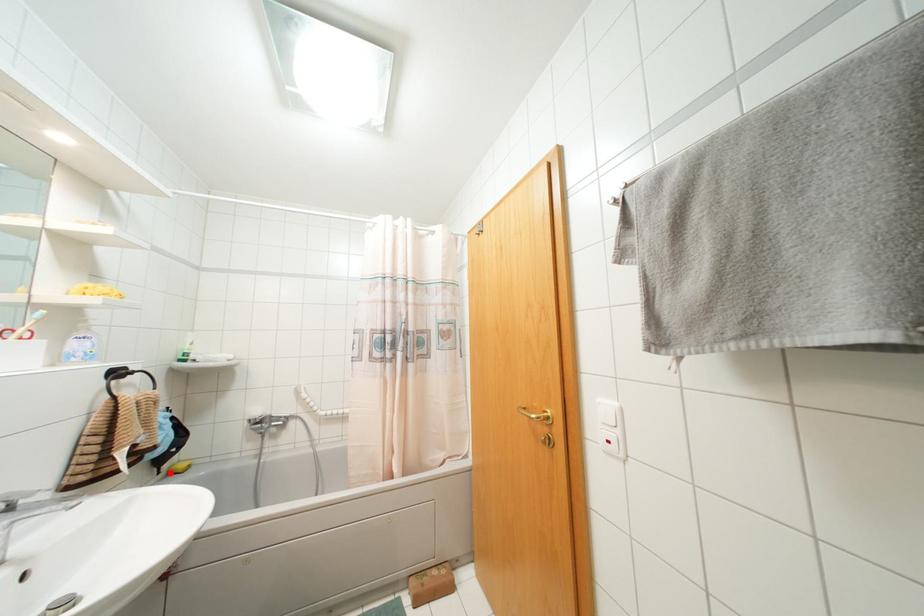
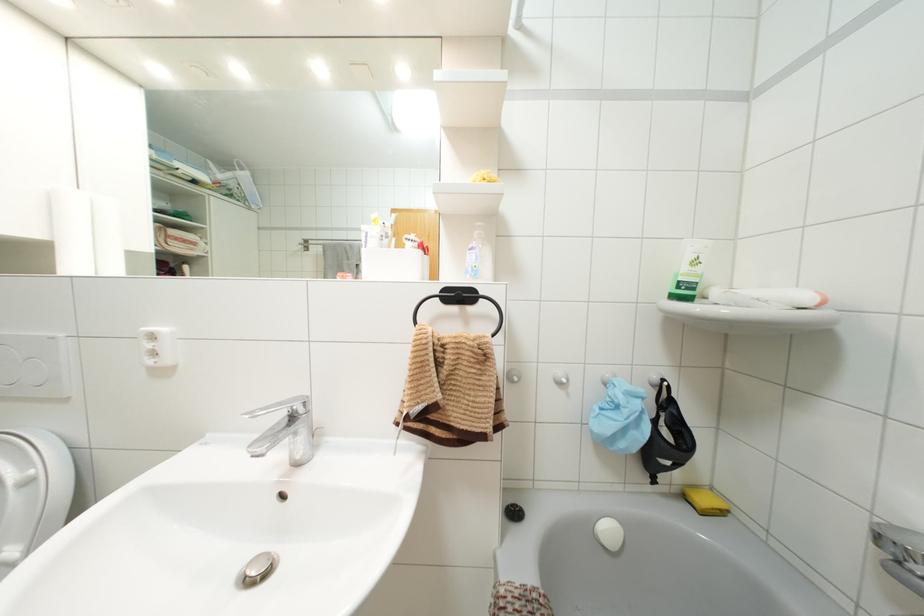
Find the pixel in the second image that matches the highlighted location in the first image.

(685, 496)